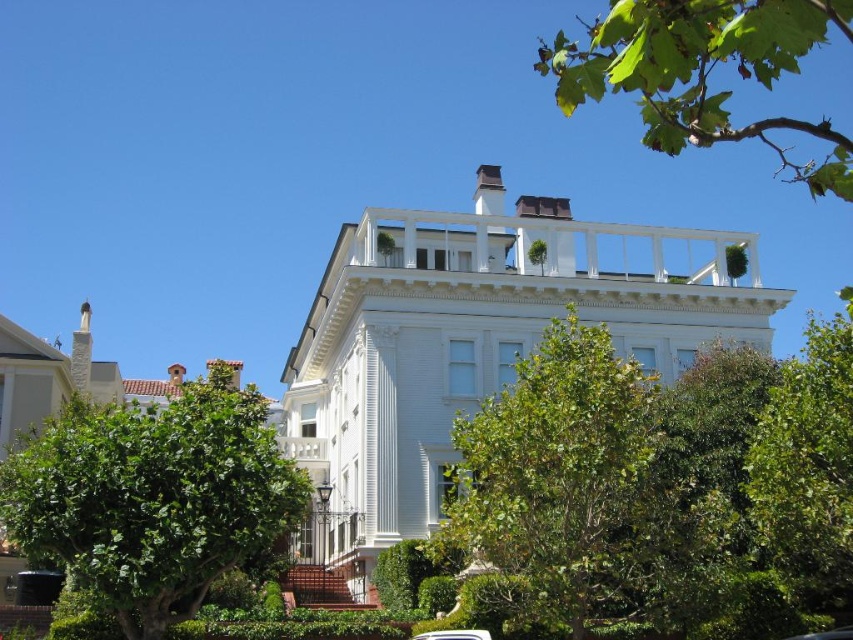
Question: Does white wood mansion at center lie behind green leafy tree at right?

Choices:
 (A) no
 (B) yes

Answer: (B)

Question: Can you confirm if white wood mansion at center is thinner than green leafy tree at lower left?

Choices:
 (A) no
 (B) yes

Answer: (A)

Question: Which object is closer to the camera taking this photo?

Choices:
 (A) white glossy car at center
 (B) green leafy tree at right

Answer: (B)

Question: Which is farther from the green leafy tree at lower left?

Choices:
 (A) green leafy tree at center
 (B) green leafy branch at upper right
 (C) white wood mansion at center
 (D) green leafy tree at right

Answer: (B)

Question: Which object is the farthest from the green leafy tree at lower left?

Choices:
 (A) green leafy tree at center
 (B) white glossy car at center

Answer: (B)

Question: Is green leafy tree at lower left smaller than green leafy tree at right?

Choices:
 (A) yes
 (B) no

Answer: (A)